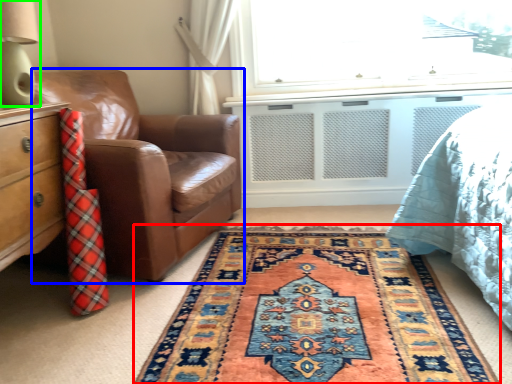
Question: Which object is the farthest from mat (highlighted by a red box)? Choose among these: chair (highlighted by a blue box) or table lamp (highlighted by a green box).

Choices:
 (A) chair
 (B) table lamp

Answer: (B)